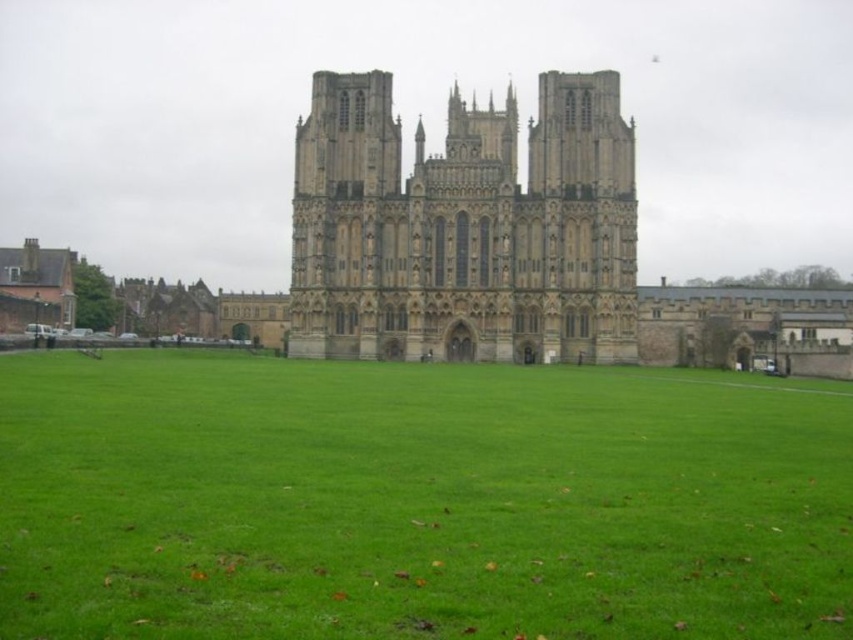
Between point (753, 637) and point (612, 298), which one is positioned in front?

Positioned in front is point (753, 637).

Can you confirm if green grass at center is thinner than stone gothic cathedral at center?

No.

Does point (258, 516) come farther from viewer compared to point (447, 196)?

No, it is not.

Identify the location of green grass at center. This screenshot has width=853, height=640. (416, 500).